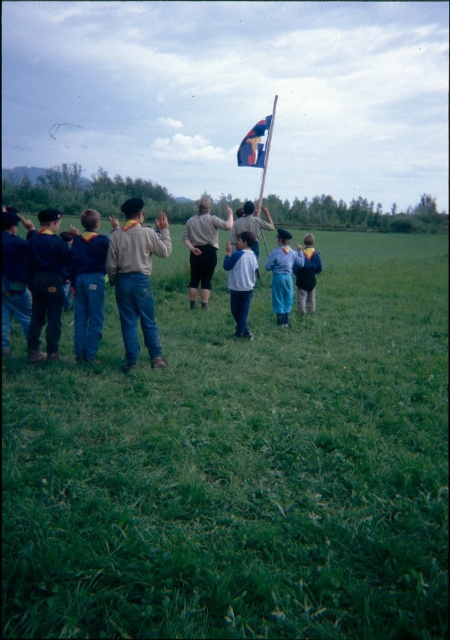
Does denim pants at left lie in front of metallic flagpole at center?

Yes, it is.

Who is positioned more to the left, denim pants at left or metallic flagpole at center?

Positioned to the left is denim pants at left.

Between point (84, 260) and point (257, 144), which one is positioned in front?

Point (84, 260)

Locate an element on the screen. Image resolution: width=450 pixels, height=640 pixels. denim pants at left is located at coordinates (88, 285).

Who is taller, green grassy field at center or matte khaki shirt at center?

With more height is green grassy field at center.

Based on the photo, is green grassy field at center above matte khaki shirt at center?

Correct, green grassy field at center is located above matte khaki shirt at center.

Who is more distant from viewer, (84, 381) or (124, 259)?

Positioned behind is point (124, 259).

This screenshot has width=450, height=640. I want to click on green grassy field at center, so click(x=241, y=465).

Is blue denim jacket at center bigger than metallic flagpole at center?

Actually, blue denim jacket at center might be smaller than metallic flagpole at center.

Is blue denim jacket at center to the left of metallic flagpole at center from the viewer's perspective?

Correct, you'll find blue denim jacket at center to the left of metallic flagpole at center.

Is point (310, 300) closer to camera compared to point (268, 141)?

Yes.

Identify the location of blue denim jacket at center. (306, 275).